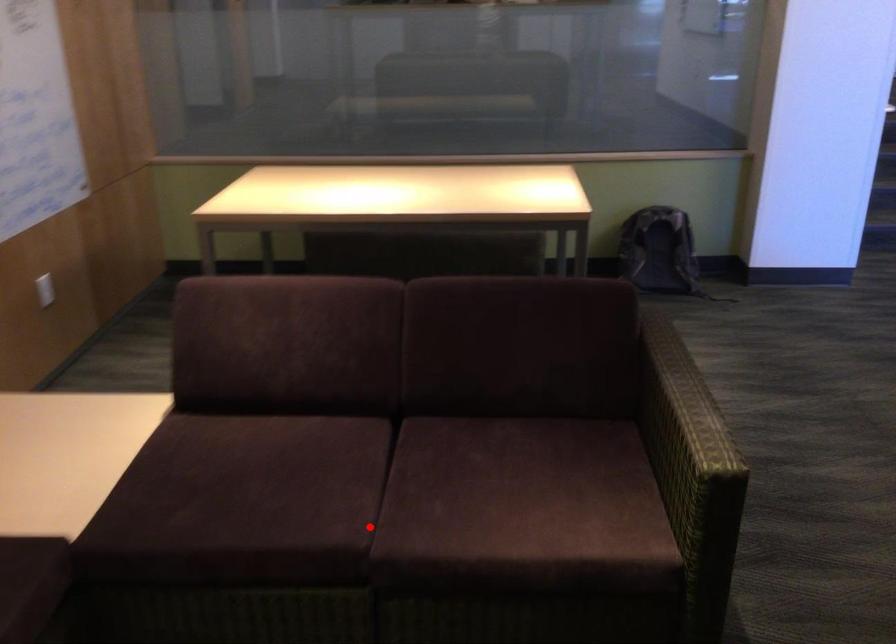
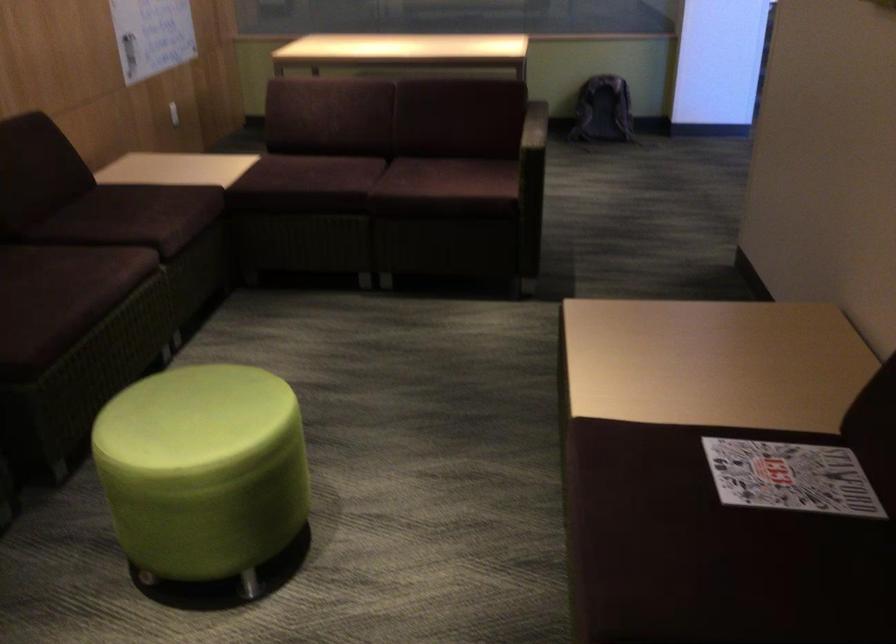
Where in the second image is the point corresponding to the highlighted location from the first image?

(371, 185)